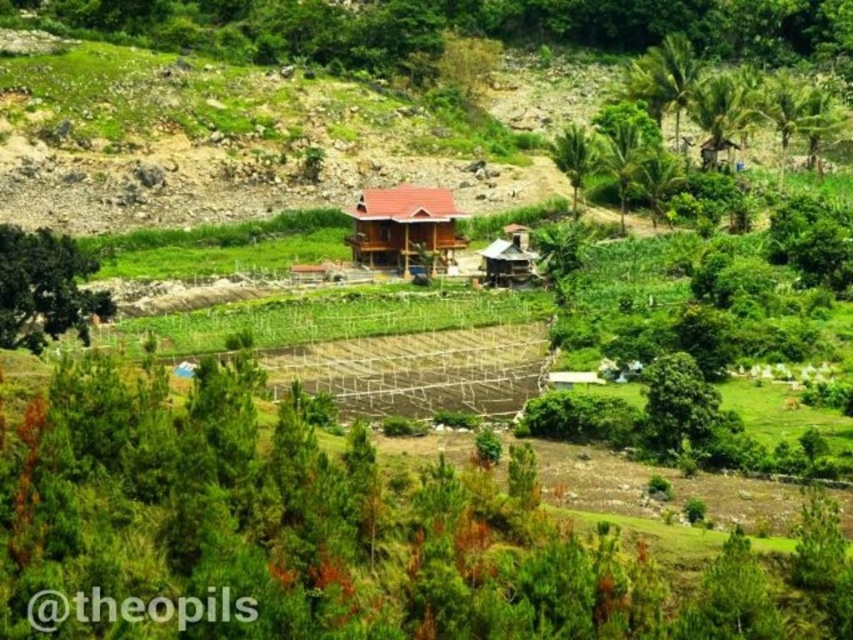
Question: Which point is closer to the camera taking this photo?

Choices:
 (A) (364, 189)
 (B) (32, 51)

Answer: (A)

Question: Does green leafy tree at upper right have a lesser width compared to green leafy tree at center-right?

Choices:
 (A) no
 (B) yes

Answer: (A)

Question: Which object is positioned farthest from the green grassy hillside at upper center?

Choices:
 (A) brown wooden hut at center
 (B) green leafy tree at left
 (C) green leafy tree at upper right

Answer: (C)

Question: Is brown wooden hut at center to the right of green leafy tree at upper right from the viewer's perspective?

Choices:
 (A) no
 (B) yes

Answer: (A)

Question: Considering the real-world distances, which object is closest to the brown wooden hut at center?

Choices:
 (A) green grassy hillside at upper center
 (B) green leafy tree at center-right
 (C) green leafy tree at upper right

Answer: (B)

Question: Does green grassy hillside at upper center come in front of green leafy tree at left?

Choices:
 (A) no
 (B) yes

Answer: (A)